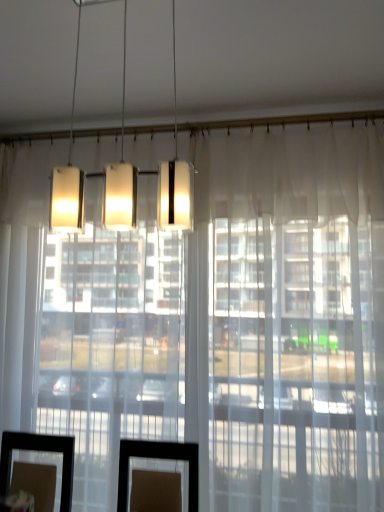
Question: From the image's perspective, is matte white rectangular light fixture at upper center located above transparent glass door at center, which appears as the 1th glass door when viewed from the right?

Choices:
 (A) yes
 (B) no

Answer: (A)

Question: Considering the relative positions of matte white rectangular light fixture at upper center and transparent glass door at center, which appears as the 1th glass door when viewed from the right, in the image provided, is matte white rectangular light fixture at upper center in front of transparent glass door at center, which appears as the 1th glass door when viewed from the right,?

Choices:
 (A) no
 (B) yes

Answer: (B)

Question: Does matte white rectangular light fixture at upper center have a greater width compared to transparent glass door at center, arranged as the 2th glass door when viewed from the left?

Choices:
 (A) no
 (B) yes

Answer: (A)

Question: Is matte white rectangular light fixture at upper center thinner than transparent glass door at center, arranged as the 2th glass door when viewed from the left?

Choices:
 (A) no
 (B) yes

Answer: (B)

Question: Is matte white rectangular light fixture at upper center positioned behind transparent glass door at center, which appears as the 1th glass door when viewed from the right?

Choices:
 (A) yes
 (B) no

Answer: (B)

Question: Is transparent glass door at center, which appears as the 1th glass door when viewed from the right, a part of matte white rectangular light fixture at upper center?

Choices:
 (A) yes
 (B) no

Answer: (B)

Question: Considering the relative sizes of transparent glass door at center, the first glass door from the left, and transparent glass door at center, arranged as the 2th glass door when viewed from the left, in the image provided, is transparent glass door at center, the first glass door from the left, taller than transparent glass door at center, arranged as the 2th glass door when viewed from the left,?

Choices:
 (A) no
 (B) yes

Answer: (A)

Question: Is the depth of transparent glass door at center, the first glass door from the left, greater than that of transparent glass door at center, arranged as the 2th glass door when viewed from the left?

Choices:
 (A) no
 (B) yes

Answer: (B)

Question: From a real-world perspective, does transparent glass door at center, the first glass door from the left, sit lower than transparent glass door at center, which appears as the 1th glass door when viewed from the right?

Choices:
 (A) no
 (B) yes

Answer: (A)

Question: Does transparent glass door at center, the first glass door from the left, turn towards transparent glass door at center, arranged as the 2th glass door when viewed from the left?

Choices:
 (A) yes
 (B) no

Answer: (B)

Question: Is transparent glass door at center, which is the second glass door from right to left, to the left of transparent glass door at center, which appears as the 1th glass door when viewed from the right, from the viewer's perspective?

Choices:
 (A) yes
 (B) no

Answer: (A)

Question: Considering the relative sizes of transparent glass door at center, which is the second glass door from right to left, and transparent glass door at center, which appears as the 1th glass door when viewed from the right, in the image provided, is transparent glass door at center, which is the second glass door from right to left, shorter than transparent glass door at center, which appears as the 1th glass door when viewed from the right,?

Choices:
 (A) no
 (B) yes

Answer: (B)

Question: Would you say transparent glass door at center, the first glass door from the left, is outside matte white rectangular light fixture at upper center?

Choices:
 (A) yes
 (B) no

Answer: (A)